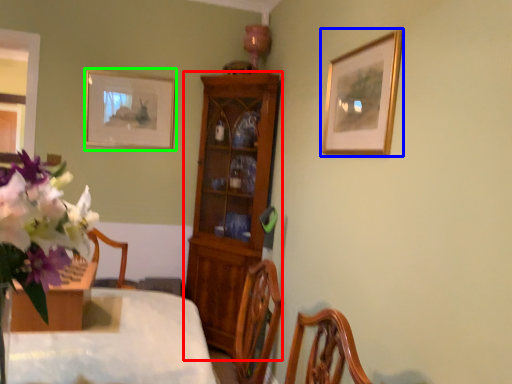
Question: Based on their relative distances, which object is nearer to cabinetry (highlighted by a red box)? Choose from picture frame (highlighted by a blue box) and picture frame (highlighted by a green box).

Choices:
 (A) picture frame
 (B) picture frame

Answer: (B)